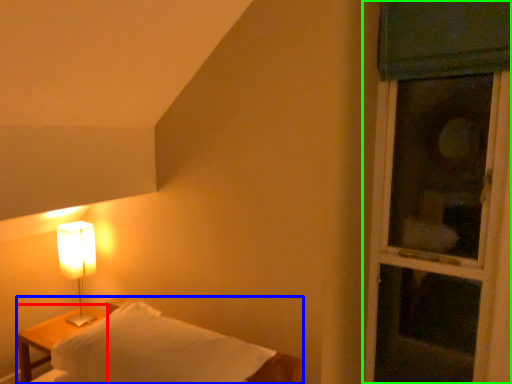
Question: Based on their relative distances, which object is nearer to nightstand (highlighted by a red box)? Choose from furniture (highlighted by a blue box) and window (highlighted by a green box).

Choices:
 (A) furniture
 (B) window

Answer: (A)